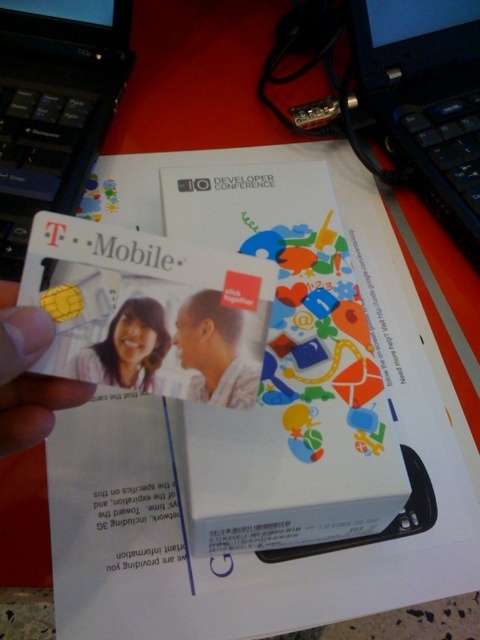
Where is the matte plastic man at center located in the image?

The matte plastic man at center is located at point (214, 352) in the image.

Consider the image. You are designing a layout for a promotional display and need to ensure there is enough space between the yellow plastic card at center and the matte plastic man at center so that they don not overlap. The minimum required spacing between them is 3 inches. Based on the image, will the current spacing meet the requirement?

The yellow plastic card at center is 2.97 inches from matte plastic man at center. Since the required spacing is 3 inches, the current spacing is slightly less than required and does not meet the requirement.